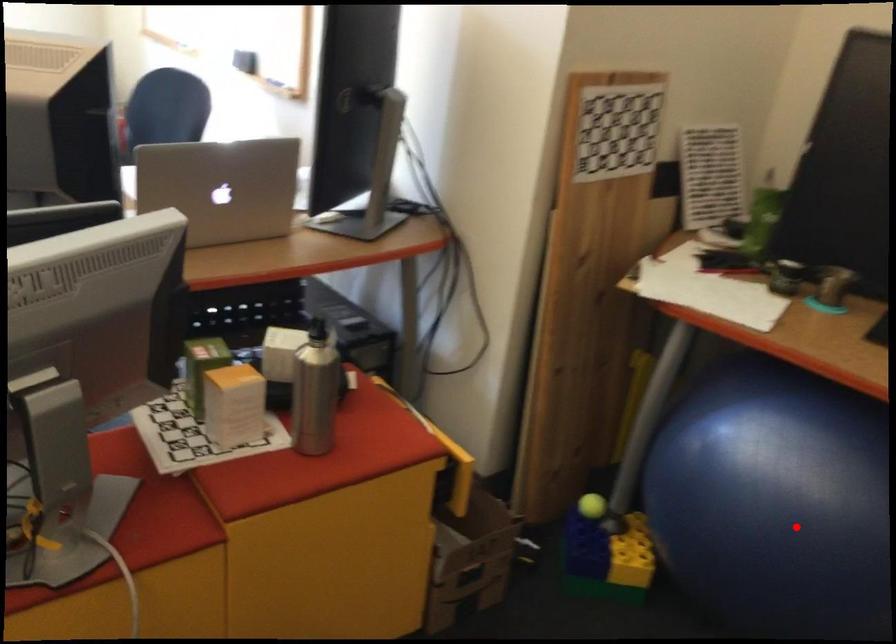
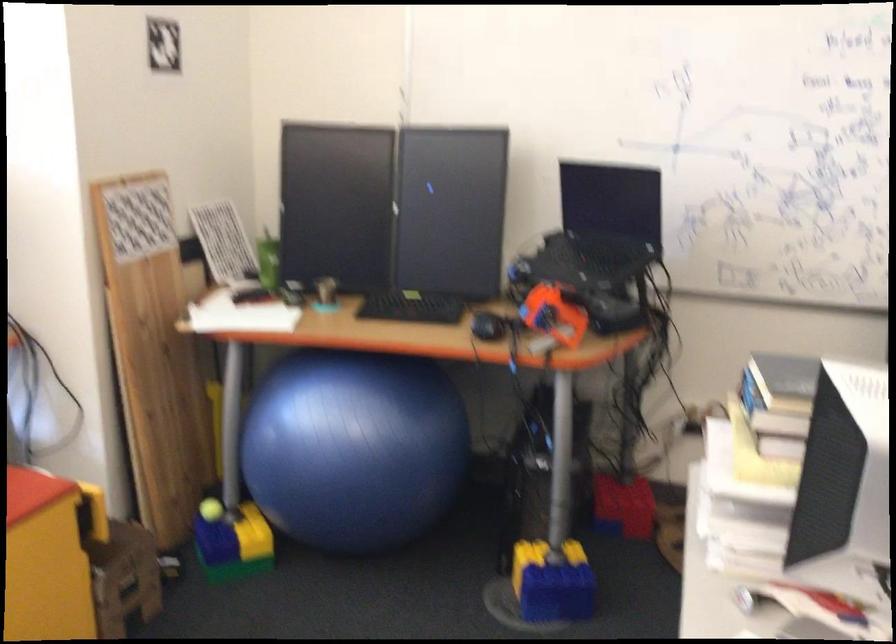
Question: I am providing you with two images of the same scene from different viewpoints. A red point is shown in image1. For the corresponding object point in image2, is it positioned nearer or farther from the camera?

Choices:
 (A) Nearer
 (B) Farther

Answer: (B)